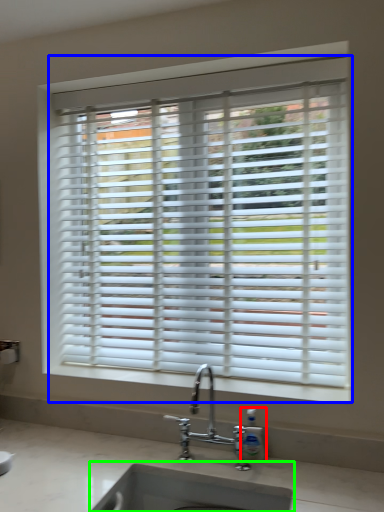
Question: Which object is positioned closest to soap dispenser (highlighted by a red box)? Select from window blind (highlighted by a blue box) and sink (highlighted by a green box).

Choices:
 (A) window blind
 (B) sink

Answer: (B)